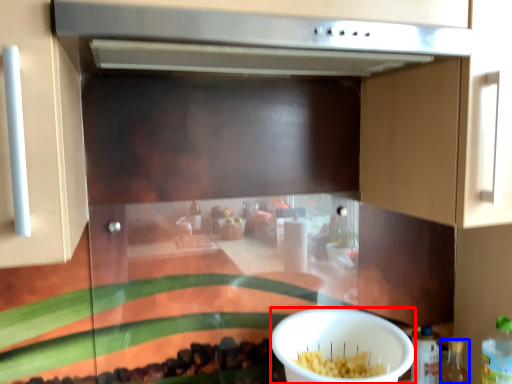
Question: Which of the following is the farthest to the observer, bowl (highlighted by a red box) or bottle (highlighted by a blue box)?

Choices:
 (A) bowl
 (B) bottle

Answer: (B)